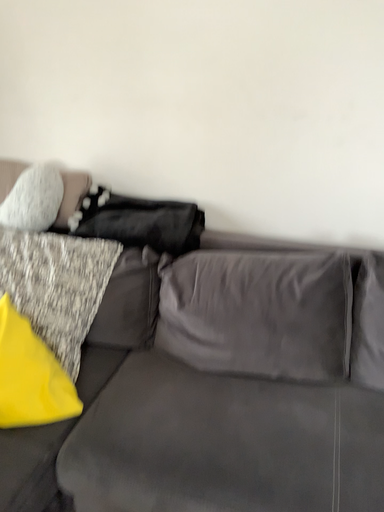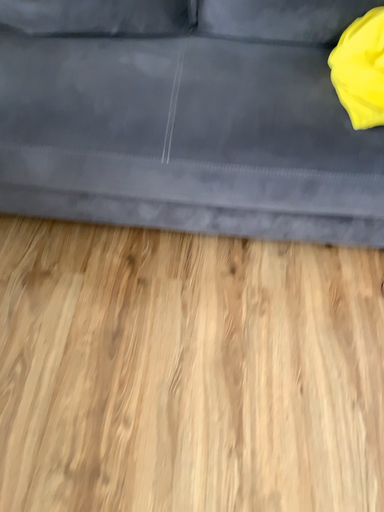
Question: How did the camera likely rotate when shooting the video?

Choices:
 (A) rotated left
 (B) rotated right

Answer: (B)